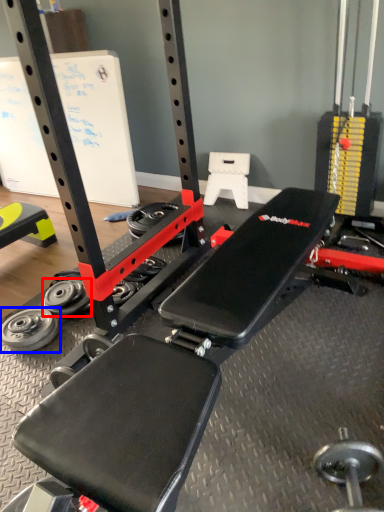
Question: Which point is further to the camera, wheel (highlighted by a red box) or wheel (highlighted by a blue box)?

Choices:
 (A) wheel
 (B) wheel

Answer: (A)